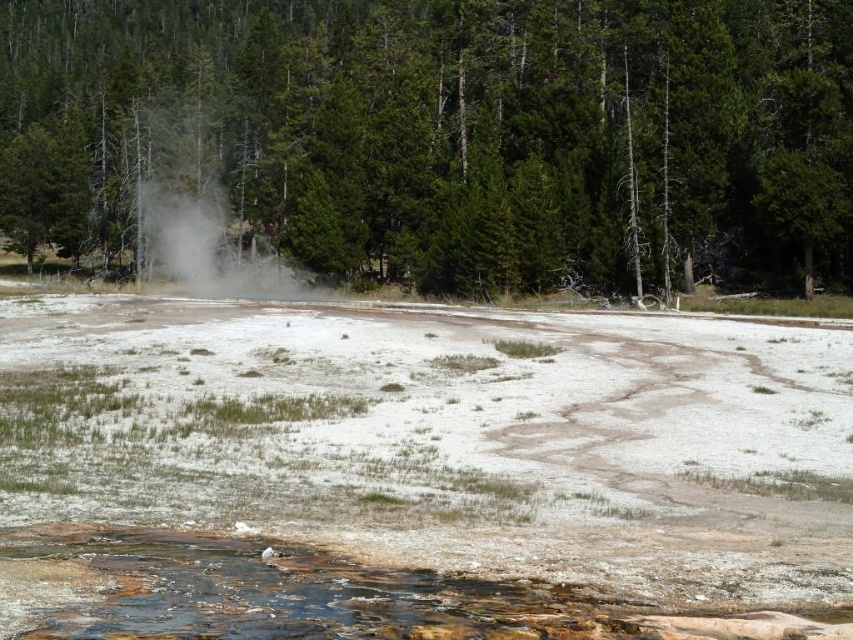
Based on the photo, is green textured tree at center in front of white vapor at center?

Yes, it is.

Between green textured tree at center and white vapor at center, which one appears on the left side from the viewer's perspective?

green textured tree at center

Does point (448, 186) lie behind point (196, 292)?

Yes, point (448, 186) is farther from viewer.

The width and height of the screenshot is (853, 640). Identify the location of green textured tree at center. (444, 136).